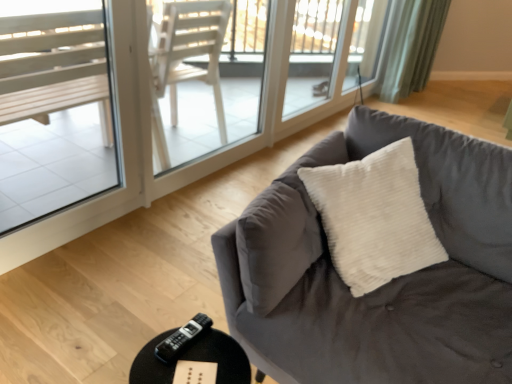
At what (x,y) coordinates should I click in order to perform the action: click on free space to the right of black plastic remote at lower center. Please return your answer as a coordinate pair (x, y). This screenshot has height=384, width=512. Looking at the image, I should click on (216, 352).